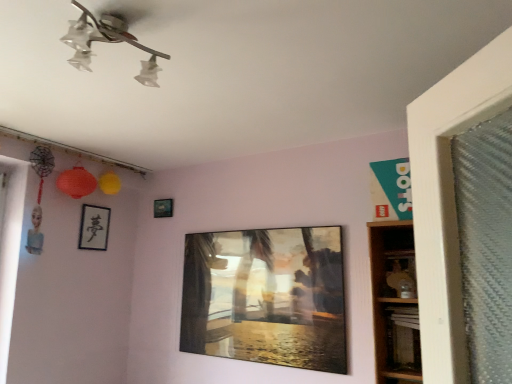
This screenshot has width=512, height=384. I want to click on wooden at right, acting as the first shelf starting from the bottom, so click(x=395, y=303).

Where is `metallic glass painting at center, acting as the 3th picture frame starting from the back`? The height and width of the screenshot is (384, 512). metallic glass painting at center, acting as the 3th picture frame starting from the back is located at coordinates (266, 297).

This screenshot has height=384, width=512. I want to click on metallic silver picture frame at upper center, placed as the 1th picture frame when sorted from back to front, so click(163, 208).

Where is `black matte picture frame at upper left, the 2th picture frame viewed from the back`? This screenshot has width=512, height=384. black matte picture frame at upper left, the 2th picture frame viewed from the back is located at coordinates (94, 227).

Between black matte picture frame at upper left, marked as the second picture frame in a front-to-back arrangement, and wooden shelf at right, the 2th shelf when ordered from bottom to top, which one has larger width?

Wider between the two is wooden shelf at right, the 2th shelf when ordered from bottom to top.

Based on the photo, from a real-world perspective, is black matte picture frame at upper left, the 3th picture frame when ordered from right to left, over wooden shelf at right, placed as the 1th shelf when sorted from top to bottom?

Yes.

In the scene shown: Which is in front, black matte picture frame at upper left, which is counted as the first picture frame, starting from the left, or wooden shelf at right, placed as the 1th shelf when sorted from top to bottom?

wooden shelf at right, placed as the 1th shelf when sorted from top to bottom, is in front.

Is metallic glass painting at center, the 3th picture frame in the left-to-right sequence, positioned with its back to wooden shelf at right, placed as the 1th shelf when sorted from top to bottom?

metallic glass painting at center, the 3th picture frame in the left-to-right sequence, does not have its back to wooden shelf at right, placed as the 1th shelf when sorted from top to bottom.

The image size is (512, 384). There is a metallic glass painting at center, acting as the 3th picture frame starting from the back. Find the location of `shelf above it (from a real-world perspective)`. shelf above it (from a real-world perspective) is located at coordinates (398, 275).

In terms of size, does metallic glass painting at center, arranged as the 1th picture frame when viewed from the front, appear bigger or smaller than wooden shelf at right, the 2th shelf when ordered from bottom to top?

Considering their sizes, metallic glass painting at center, arranged as the 1th picture frame when viewed from the front, takes up more space than wooden shelf at right, the 2th shelf when ordered from bottom to top.

From the image's perspective, would you say metallic glass painting at center, the 3th picture frame in the left-to-right sequence, is positioned over wooden shelf at right, placed as the 1th shelf when sorted from top to bottom?

No.

Considering their positions, is wooden shelf at right, placed as the 1th shelf when sorted from top to bottom, located in front of or behind wooden at right, acting as the first shelf starting from the bottom?

Clearly, wooden shelf at right, placed as the 1th shelf when sorted from top to bottom, is behind wooden at right, acting as the first shelf starting from the bottom.

Which of these two, wooden shelf at right, placed as the 1th shelf when sorted from top to bottom, or wooden at right, acting as the first shelf starting from the bottom, stands taller?

wooden at right, acting as the first shelf starting from the bottom, is taller.

Between wooden shelf at right, placed as the 1th shelf when sorted from top to bottom, and wooden at right, which is the second shelf from top to bottom, which one appears on the left side from the viewer's perspective?

From the viewer's perspective, wooden shelf at right, placed as the 1th shelf when sorted from top to bottom, appears more on the left side.

The height and width of the screenshot is (384, 512). I want to click on shelf located above the wooden at right, acting as the first shelf starting from the bottom (from a real-world perspective), so click(x=398, y=275).

From the picture: From the image's perspective, who appears lower, wooden shelf at right, placed as the 1th shelf when sorted from top to bottom, or metallic silver picture frame at upper center, placed as the 1th picture frame when sorted from back to front?

wooden shelf at right, placed as the 1th shelf when sorted from top to bottom, is shown below in the image.

Can you confirm if wooden shelf at right, the 2th shelf when ordered from bottom to top, is positioned to the right of metallic silver picture frame at upper center, which ranks as the third picture frame in front-to-back order?

Indeed, wooden shelf at right, the 2th shelf when ordered from bottom to top, is positioned on the right side of metallic silver picture frame at upper center, which ranks as the third picture frame in front-to-back order.

Considering the sizes of wooden shelf at right, placed as the 1th shelf when sorted from top to bottom, and metallic silver picture frame at upper center, the 2th picture frame positioned from the left, in the image, is wooden shelf at right, placed as the 1th shelf when sorted from top to bottom, taller or shorter than metallic silver picture frame at upper center, the 2th picture frame positioned from the left,?

wooden shelf at right, placed as the 1th shelf when sorted from top to bottom, is taller than metallic silver picture frame at upper center, the 2th picture frame positioned from the left.

Is wooden shelf at right, placed as the 1th shelf when sorted from top to bottom, beside metallic silver picture frame at upper center, placed as the 1th picture frame when sorted from back to front?

There is a gap between wooden shelf at right, placed as the 1th shelf when sorted from top to bottom, and metallic silver picture frame at upper center, placed as the 1th picture frame when sorted from back to front.

Which point is more distant from viewer, (96, 207) or (398, 298)?

The point (96, 207) is behind.

Considering the relative positions of black matte picture frame at upper left, marked as the second picture frame in a front-to-back arrangement, and wooden at right, acting as the first shelf starting from the bottom, in the image provided, is black matte picture frame at upper left, marked as the second picture frame in a front-to-back arrangement, to the right of wooden at right, acting as the first shelf starting from the bottom, from the viewer's perspective?

No.

Based on the photo, from their relative heights in the image, would you say black matte picture frame at upper left, the 3th picture frame when ordered from right to left, is taller or shorter than wooden at right, acting as the first shelf starting from the bottom?

Clearly, black matte picture frame at upper left, the 3th picture frame when ordered from right to left, is shorter compared to wooden at right, acting as the first shelf starting from the bottom.

Relative to wooden at right, which is the second shelf from top to bottom, is black matte picture frame at upper left, which is counted as the first picture frame, starting from the left, in front or behind?

black matte picture frame at upper left, which is counted as the first picture frame, starting from the left, is positioned farther from the viewer than wooden at right, which is the second shelf from top to bottom.

Can you see wooden at right, acting as the first shelf starting from the bottom, touching metallic silver picture frame at upper center, the 2th picture frame positioned from the left?

No.

From a real-world perspective, is wooden at right, acting as the first shelf starting from the bottom, physically above metallic silver picture frame at upper center, the 2th picture frame positioned from the left?

No, from a real-world perspective, wooden at right, acting as the first shelf starting from the bottom, is not above metallic silver picture frame at upper center, the 2th picture frame positioned from the left.

From the picture: How different are the orientations of wooden at right, which is the second shelf from top to bottom, and metallic silver picture frame at upper center, placed as the 1th picture frame when sorted from back to front, in degrees?

They differ by 1.47 degrees in their facing directions.

Is wooden at right, acting as the first shelf starting from the bottom, to the left of metallic silver picture frame at upper center, which ranks as the third picture frame in front-to-back order, from the viewer's perspective?

Incorrect, wooden at right, acting as the first shelf starting from the bottom, is not on the left side of metallic silver picture frame at upper center, which ranks as the third picture frame in front-to-back order.

How many degrees apart are the facing directions of metallic silver picture frame at upper center, which ranks as the third picture frame in front-to-back order, and black matte picture frame at upper left, the 3th picture frame when ordered from right to left?

The angle between the facing direction of metallic silver picture frame at upper center, which ranks as the third picture frame in front-to-back order, and the facing direction of black matte picture frame at upper left, the 3th picture frame when ordered from right to left, is 92.2 degrees.

In the scene shown: Which object is positioned more to the left, metallic silver picture frame at upper center, the 2th picture frame positioned from the left, or black matte picture frame at upper left, the 3th picture frame when ordered from right to left?

black matte picture frame at upper left, the 3th picture frame when ordered from right to left.

Is metallic silver picture frame at upper center, the 2th picture frame positioned from the left, thinner than black matte picture frame at upper left, the 3th picture frame when ordered from right to left?

Yes, metallic silver picture frame at upper center, the 2th picture frame positioned from the left, is thinner than black matte picture frame at upper left, the 3th picture frame when ordered from right to left.

Where is `picture frame that is above the black matte picture frame at upper left, which is counted as the first picture frame, starting from the left (from the image's perspective)`? picture frame that is above the black matte picture frame at upper left, which is counted as the first picture frame, starting from the left (from the image's perspective) is located at coordinates (163, 208).

Which shelf is the 1st one when counting from the front of the black matte picture frame at upper left, marked as the second picture frame in a front-to-back arrangement? Please provide its 2D coordinates.

[(398, 275)]

At what (x,y) coordinates should I click in order to perform the action: click on the 2nd shelf above the metallic glass painting at center, acting as the 3th picture frame starting from the back (from the image's perspective). Please return your answer as a coordinate pair (x, y). The width and height of the screenshot is (512, 384). Looking at the image, I should click on (398, 275).

From the image, which object appears to be farther from metallic silver picture frame at upper center, which ranks as the third picture frame in front-to-back order, metallic glass painting at center, arranged as the 1th picture frame when viewed from the front, or black matte picture frame at upper left, marked as the second picture frame in a front-to-back arrangement?

metallic glass painting at center, arranged as the 1th picture frame when viewed from the front, is further to metallic silver picture frame at upper center, which ranks as the third picture frame in front-to-back order.

Estimate the real-world distances between objects in this image. Which object is further from clear glass light fixture at upper center, wooden at right, which is the second shelf from top to bottom, or metallic glass painting at center, arranged as the 1th picture frame when viewed from the front?

metallic glass painting at center, arranged as the 1th picture frame when viewed from the front, is further to clear glass light fixture at upper center.

Estimate the real-world distances between objects in this image. Which object is further from wooden shelf at right, placed as the 1th shelf when sorted from top to bottom, metallic silver picture frame at upper center, placed as the second picture frame when sorted from right to left, or wooden at right, acting as the first shelf starting from the bottom?

Among the two, metallic silver picture frame at upper center, placed as the second picture frame when sorted from right to left, is located further to wooden shelf at right, placed as the 1th shelf when sorted from top to bottom.

Estimate the real-world distances between objects in this image. Which object is closer to clear glass light fixture at upper center, metallic silver picture frame at upper center, placed as the 1th picture frame when sorted from back to front, or wooden at right, which is the second shelf from top to bottom?

wooden at right, which is the second shelf from top to bottom, lies closer to clear glass light fixture at upper center than the other object.

Estimate the real-world distances between objects in this image. Which object is closer to clear glass light fixture at upper center, metallic silver picture frame at upper center, the 2th picture frame positioned from the left, or wooden shelf at right, placed as the 1th shelf when sorted from top to bottom?

wooden shelf at right, placed as the 1th shelf when sorted from top to bottom.

Looking at the image, which one is located further to metallic glass painting at center, the 3th picture frame in the left-to-right sequence, metallic silver picture frame at upper center, placed as the 1th picture frame when sorted from back to front, or clear glass light fixture at upper center?

clear glass light fixture at upper center is positioned further to the anchor metallic glass painting at center, the 3th picture frame in the left-to-right sequence.

Based on their spatial positions, is clear glass light fixture at upper center or black matte picture frame at upper left, the 3th picture frame when ordered from right to left, closer to wooden at right, which is the second shelf from top to bottom?

Among the two, clear glass light fixture at upper center is located nearer to wooden at right, which is the second shelf from top to bottom.

From the image, which object appears to be nearer to metallic silver picture frame at upper center, which ranks as the third picture frame in front-to-back order, metallic glass painting at center, the 1th picture frame viewed from the right, or wooden shelf at right, the 2th shelf when ordered from bottom to top?

Among the two, metallic glass painting at center, the 1th picture frame viewed from the right, is located nearer to metallic silver picture frame at upper center, which ranks as the third picture frame in front-to-back order.

Locate an element on the screen. The height and width of the screenshot is (384, 512). picture frame between metallic silver picture frame at upper center, placed as the 1th picture frame when sorted from back to front, and wooden shelf at right, the 2th shelf when ordered from bottom to top, from left to right is located at coordinates (266, 297).

Identify the location of shelf between black matte picture frame at upper left, which is counted as the first picture frame, starting from the left, and wooden at right, which is the second shelf from top to bottom, from left to right. The height and width of the screenshot is (384, 512). (398, 275).

Locate an element on the screen. The height and width of the screenshot is (384, 512). lamp located between black matte picture frame at upper left, which is counted as the first picture frame, starting from the left, and wooden at right, which is the second shelf from top to bottom, in the left-right direction is located at coordinates (110, 38).

You are a GUI agent. You are given a task and a screenshot of the screen. Output one action in this format:
    pyautogui.click(x=<x>, y=<y>)
    Task: Click on the shelf situated between clear glass light fixture at upper center and wooden at right, acting as the first shelf starting from the bottom, from left to right
    The width and height of the screenshot is (512, 384).
    Given the screenshot: What is the action you would take?
    pyautogui.click(x=398, y=275)